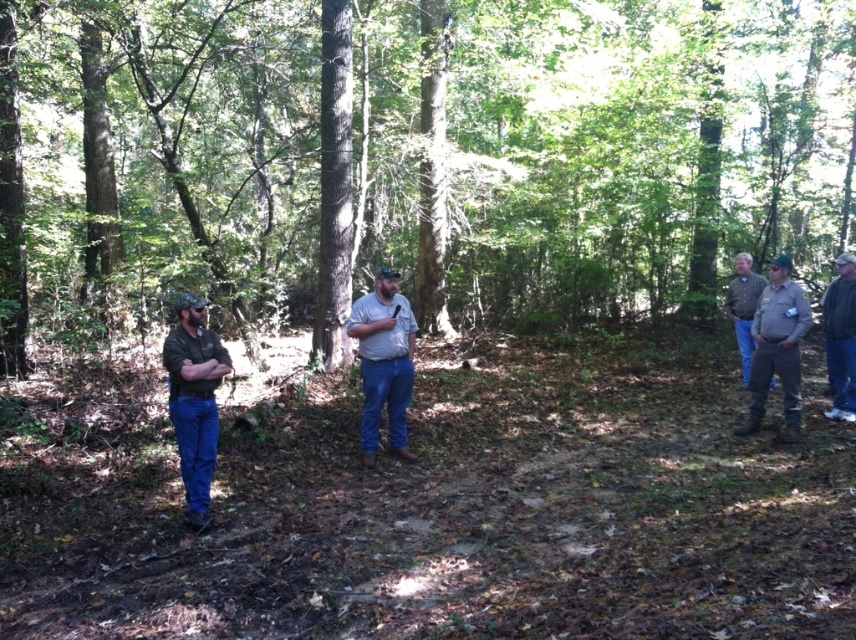
Question: Which of the following is the closest to the observer?

Choices:
 (A) (388, 342)
 (B) (189, 477)

Answer: (B)

Question: Is denim jeans at center positioned at the back of brown uniform at right?

Choices:
 (A) no
 (B) yes

Answer: (A)

Question: Among these objects, which one is nearest to the camera?

Choices:
 (A) denim jeans at center
 (B) brown textured tree at center
 (C) brown leather jacket at right
 (D) brown uniform at right

Answer: (A)

Question: Does brown uniform at right have a larger size compared to brown leather jacket at right?

Choices:
 (A) yes
 (B) no

Answer: (A)

Question: Which of the following is the farthest from the observer?

Choices:
 (A) brown textured tree at center
 (B) denim jeans at center
 (C) brown uniform at right
 (D) brown leather jacket at right

Answer: (D)

Question: Can you confirm if brown uniform at right is thinner than blue denim jeans at lower right?

Choices:
 (A) yes
 (B) no

Answer: (A)